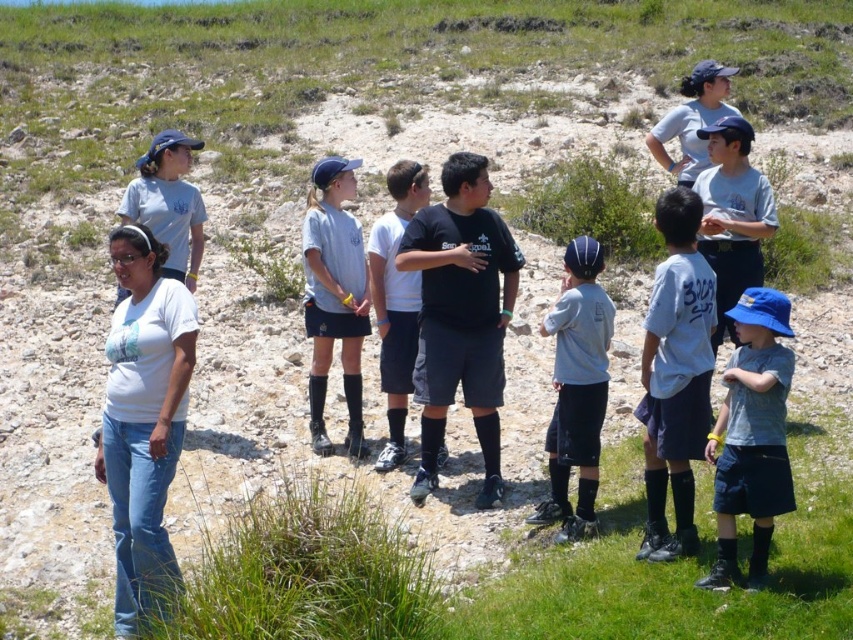
Question: Which of the following is the farthest from the observer?

Choices:
 (A) gray cotton shirt at center
 (B) white matte t-shirt at lower left

Answer: (A)

Question: Which of the following is the farthest from the observer?

Choices:
 (A) gray matte shirt at center
 (B) gray cotton shirt at center
 (C) white matte uniform at center
 (D) black matte shorts at center

Answer: (C)

Question: Is white cotton shirt at center bigger than black matte shorts at center?

Choices:
 (A) yes
 (B) no

Answer: (B)

Question: From the image, what is the correct spatial relationship of white matte uniform at center in relation to gray cotton shirt at center?

Choices:
 (A) above
 (B) below

Answer: (B)

Question: From the image, what is the correct spatial relationship of white cotton shirt at center in relation to gray cotton shirt at center?

Choices:
 (A) left
 (B) right

Answer: (A)

Question: Which point appears closest to the camera in this image?

Choices:
 (A) (328, 188)
 (B) (695, 540)
 (C) (165, 360)

Answer: (C)